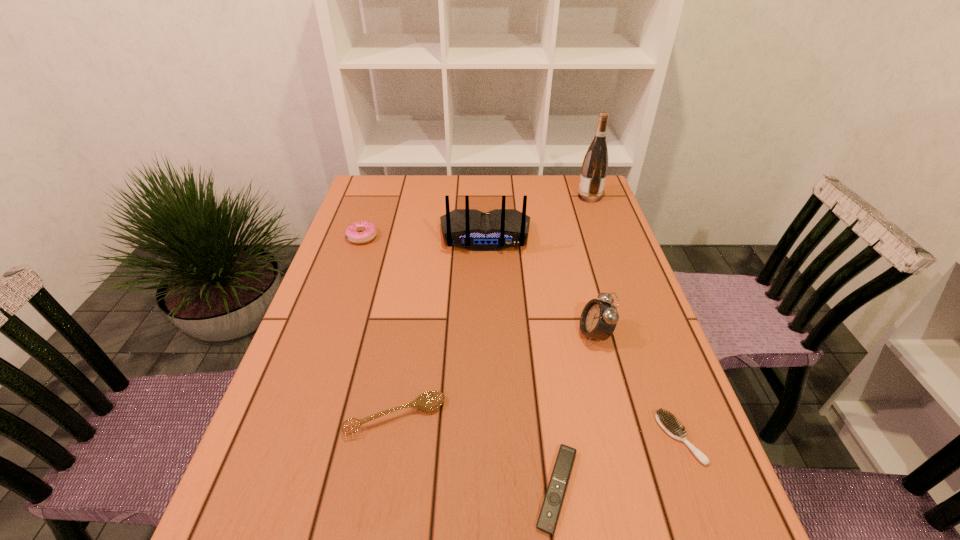
The image size is (960, 540). I want to click on wine bottle, so click(595, 164).

You are a GUI agent. You are given a task and a screenshot of the screen. Output one action in this format:
    pyautogui.click(x=<x>, y=<y>)
    Task: Click on the tallest object
    This screenshot has width=960, height=540.
    Given the screenshot: What is the action you would take?
    pyautogui.click(x=595, y=164)

At what (x,y) coordinates should I click in order to perform the action: click on the second tallest object. Please return your answer as a coordinate pair (x, y). This screenshot has height=540, width=960. Looking at the image, I should click on (495, 230).

This screenshot has height=540, width=960. What are the coordinates of `the third tallest object` in the screenshot? It's located at (598, 320).

Where is `the fourth nearest object`? the fourth nearest object is located at coordinates (598, 320).

Where is `the leftmost object`? The image size is (960, 540). the leftmost object is located at coordinates (361, 232).

Find the location of a particular element. This screenshot has height=540, width=960. doughnut is located at coordinates (361, 232).

Where is `ladle`? The height and width of the screenshot is (540, 960). ladle is located at coordinates (428, 401).

At what (x,y) coordinates should I click in order to perform the action: click on the second shortest object. Please return your answer as a coordinate pair (x, y). The height and width of the screenshot is (540, 960). Looking at the image, I should click on (667, 422).

You are a GUI agent. You are given a task and a screenshot of the screen. Output one action in this format:
    pyautogui.click(x=<x>, y=<y>)
    Task: Click on the remote control
    This screenshot has height=540, width=960.
    Given the screenshot: What is the action you would take?
    pyautogui.click(x=551, y=507)